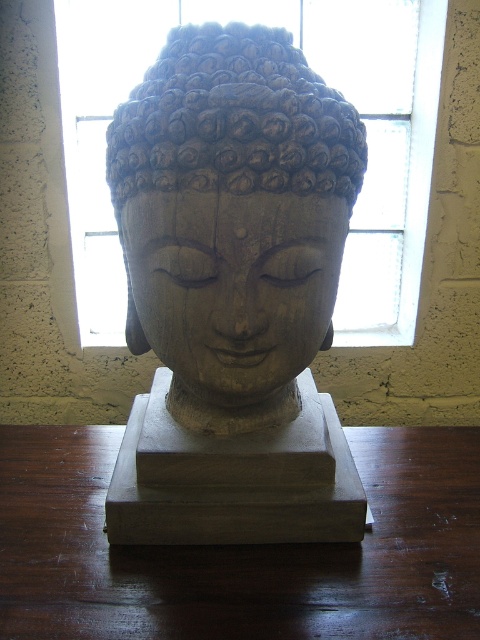
Question: Can you confirm if wooden statue at center is wider than wooden sculpture at center?

Choices:
 (A) yes
 (B) no

Answer: (A)

Question: From the image, what is the correct spatial relationship of wooden statue at center in relation to wooden sculpture at center?

Choices:
 (A) left
 (B) right

Answer: (B)

Question: Is wooden statue at center wider than transparent glass window at center?

Choices:
 (A) yes
 (B) no

Answer: (B)

Question: Which point is closer to the camera taking this photo?

Choices:
 (A) (411, 1)
 (B) (170, 260)

Answer: (B)

Question: Which point is farther from the camera taking this photo?

Choices:
 (A) (142, 262)
 (B) (55, 579)

Answer: (B)

Question: Among these objects, which one is farthest from the camera?

Choices:
 (A) transparent glass window at center
 (B) wooden statue at center

Answer: (A)